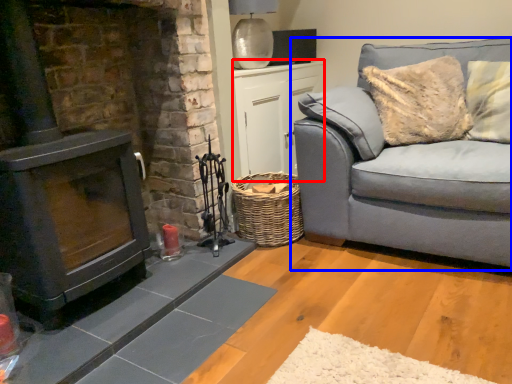
Question: Among these objects, which one is nearest to the camera, table (highlighted by a red box) or studio couch (highlighted by a blue box)?

Choices:
 (A) table
 (B) studio couch

Answer: (B)